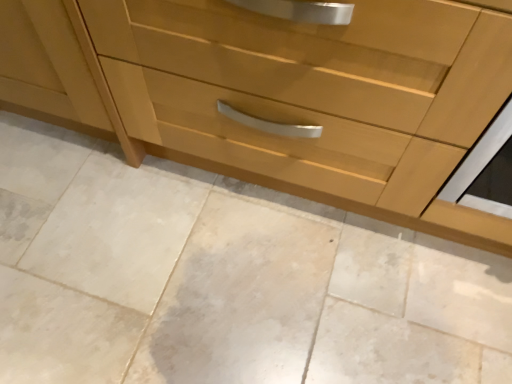
Identify the location of matte wood chest of drawers at center. Image resolution: width=512 pixels, height=384 pixels. (296, 98).

Image resolution: width=512 pixels, height=384 pixels. Describe the element at coordinates (296, 98) in the screenshot. I see `matte wood chest of drawers at center` at that location.

Locate an element on the screen. matte wood chest of drawers at center is located at coordinates (296, 98).